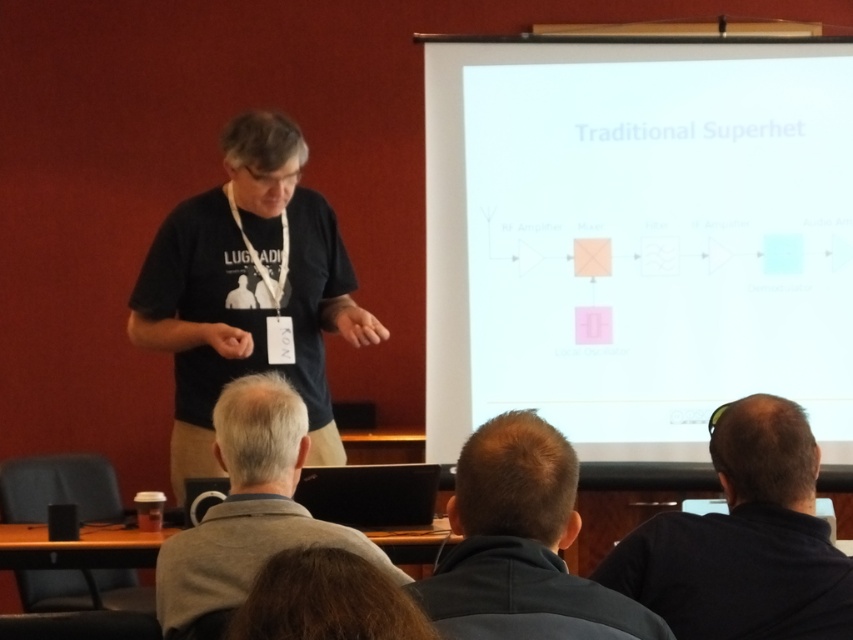
Is white paper at upper center above black matte shirt at lower right?

Indeed, white paper at upper center is positioned over black matte shirt at lower right.

Does white paper at upper center have a lesser width compared to black matte shirt at lower right?

In fact, white paper at upper center might be wider than black matte shirt at lower right.

Does point (695, 422) come farther from viewer compared to point (764, 464)?

Yes, point (695, 422) is farther from viewer.

Where is `white paper at upper center`? white paper at upper center is located at coordinates (636, 237).

Does black t-shirt at center have a smaller size compared to dark brown hair at lower center?

Incorrect, black t-shirt at center is not smaller in size than dark brown hair at lower center.

Who is shorter, black t-shirt at center or dark brown hair at lower center?

With less height is dark brown hair at lower center.

What do you see at coordinates (248, 291) in the screenshot?
I see `black t-shirt at center` at bounding box center [248, 291].

Locate an element on the screen. The height and width of the screenshot is (640, 853). black t-shirt at center is located at coordinates (248, 291).

Does dark brown hair at lower center come behind gray woolen sweater at lower left?

No, it is not.

Who is shorter, dark brown hair at lower center or gray woolen sweater at lower left?

Standing shorter between the two is dark brown hair at lower center.

Who is more forward, (515, 458) or (262, 513)?

Point (515, 458) is in front.

The width and height of the screenshot is (853, 640). I want to click on dark brown hair at lower center, so (521, 545).